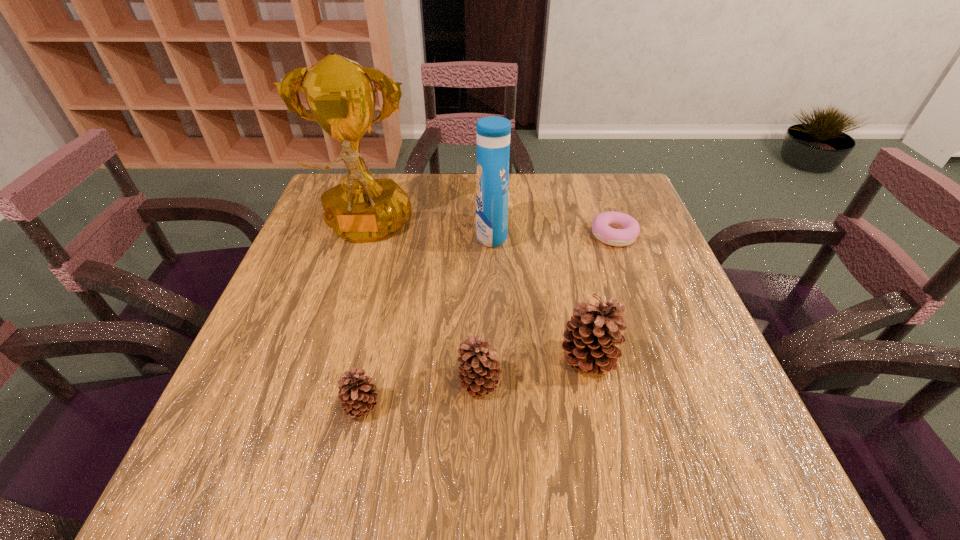
The height and width of the screenshot is (540, 960). I want to click on vacant region located 0.320m on the back of the leftmost pinecone, so click(392, 272).

Locate an element on the screen. This screenshot has height=540, width=960. free space located on the back of the third shortest object is located at coordinates (480, 287).

The image size is (960, 540). I want to click on vacant area situated 0.060m on the front of the fifth object from left to right, so click(x=599, y=414).

Locate an element on the screen. The width and height of the screenshot is (960, 540). free space located on the back of the shortest object is located at coordinates point(603,205).

You are a GUI agent. You are given a task and a screenshot of the screen. Output one action in this format:
    pyautogui.click(x=<x>, y=<y>)
    Task: Click on the vacant point located on the front-facing side of the fifth shortest object
    Image resolution: width=960 pixels, height=540 pixels.
    Given the screenshot: What is the action you would take?
    pyautogui.click(x=441, y=234)

Find the location of `vacant area situated on the front-facing side of the fifth shortest object`. vacant area situated on the front-facing side of the fifth shortest object is located at coordinates (433, 234).

Where is `free space located on the front-facing side of the fifth shortest object`? The width and height of the screenshot is (960, 540). free space located on the front-facing side of the fifth shortest object is located at coordinates (444, 234).

Where is `free space located on the front side of the award`? The image size is (960, 540). free space located on the front side of the award is located at coordinates (304, 421).

Where is `detergent situated at the far edge`? The image size is (960, 540). detergent situated at the far edge is located at coordinates (493, 133).

Find the location of a particular element. The image size is (960, 540). award positioned at the far edge is located at coordinates (340, 94).